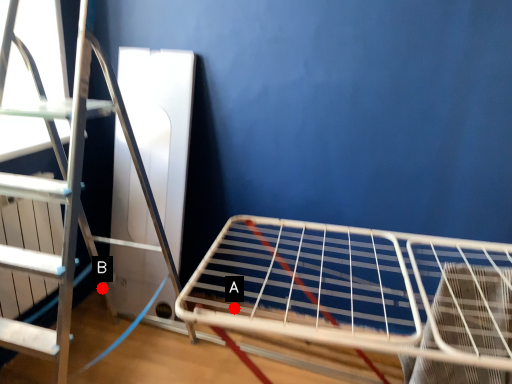
Question: Two points are circled on the image, labeled by A and B beside each circle. Which point is closer to the camera?

Choices:
 (A) A is closer
 (B) B is closer

Answer: (A)